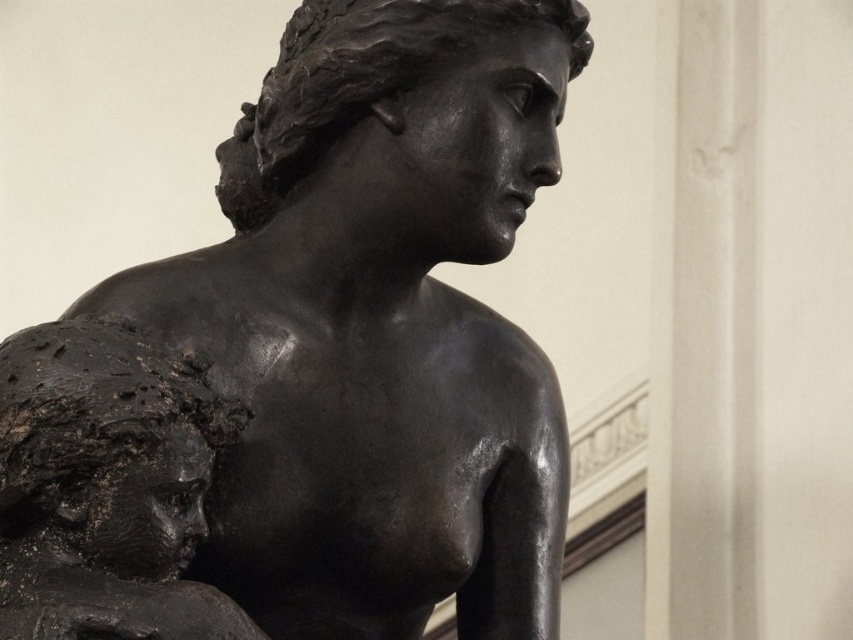
Question: Which point is closer to the camera?

Choices:
 (A) shiny bronze statue at center
 (B) matte black bust at left

Answer: (B)

Question: Where is shiny bronze statue at center located in relation to matte black bust at left in the image?

Choices:
 (A) above
 (B) below

Answer: (A)

Question: Considering the relative positions of shiny bronze statue at center and matte black bust at left in the image provided, where is shiny bronze statue at center located with respect to matte black bust at left?

Choices:
 (A) left
 (B) right

Answer: (B)

Question: Among these objects, which one is farthest from the camera?

Choices:
 (A) matte black bust at left
 (B) shiny bronze statue at center

Answer: (B)

Question: Does shiny bronze statue at center have a lesser width compared to matte black bust at left?

Choices:
 (A) yes
 (B) no

Answer: (B)